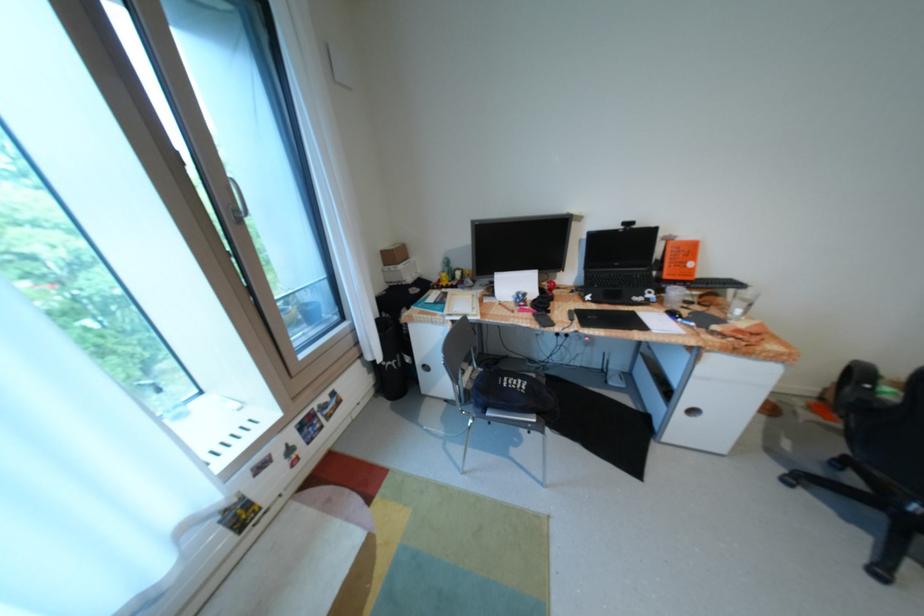
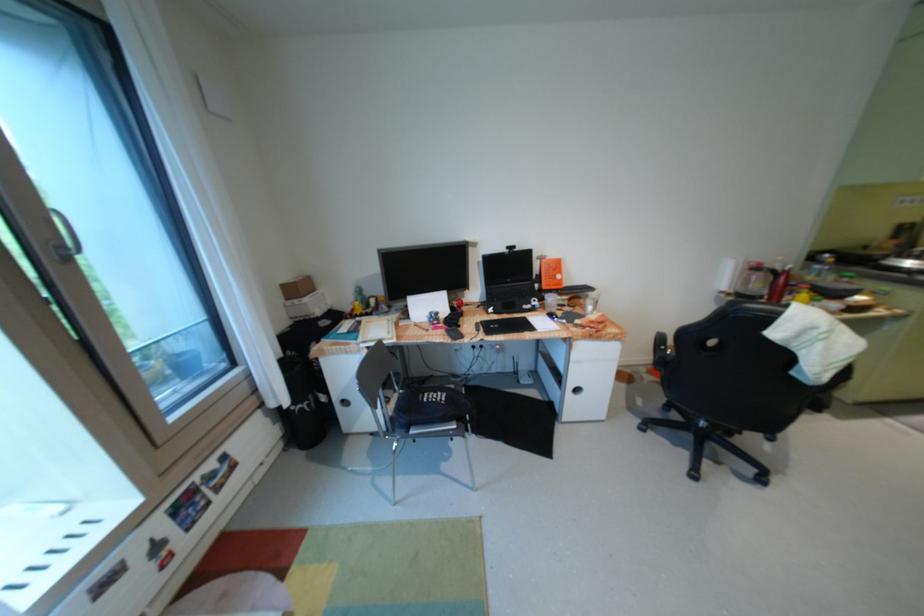
Locate, in the second image, the point that corresponds to point 531,300 in the first image.

(444, 318)